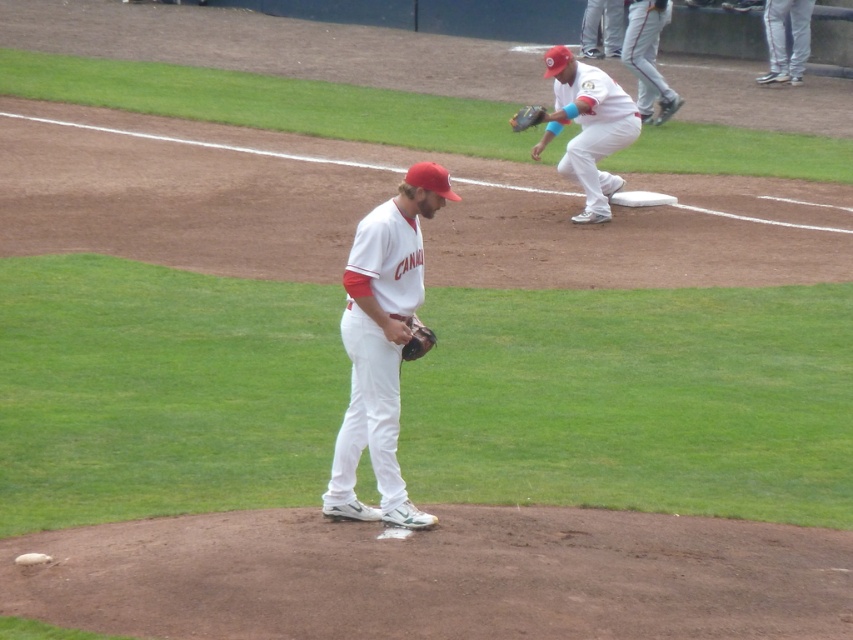
You are a baseball coach analyzing the positions of two players during a game. You notice two points on the field marked as point [618,20] and point [415,324]. Based on their coordinates, which point is positioned further back from the home plate?

Point [618,20] is behind point [415,324], so it is positioned further back from the home plate.

You are a photographer standing at the edge of the baseball field. You want to take a photo that includes both the pitcher and the first baseman. The pitcher is at point (368, 518) and the first baseman is at point (595, 52). Which player is closer to your camera position?

Point (368, 518) is closer to the camera than point (595, 52), so the pitcher at point (368, 518) is closer to your camera position.